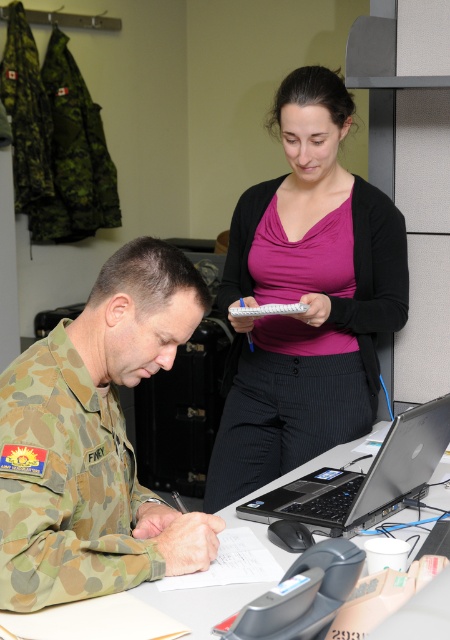
Between pink matte sweater at center and camouflage uniform at center, which one has less height?

With less height is camouflage uniform at center.

Is pink matte sweater at center in front of camouflage uniform at center?

That is False.

Identify the location of pink matte sweater at center. (306, 298).

Can you confirm if pink matte sweater at center is positioned above silver/black laptop at center?

Yes.

Where is `pink matte sweater at center`? This screenshot has width=450, height=640. pink matte sweater at center is located at coordinates (306, 298).

Between point (244, 253) and point (418, 477), which one is positioned behind?

The point (244, 253) is behind.

You are a GUI agent. You are given a task and a screenshot of the screen. Output one action in this format:
    pyautogui.click(x=<x>, y=<y>)
    Task: Click on the pink matte sweater at center
    This screenshot has width=450, height=640.
    Given the screenshot: What is the action you would take?
    pyautogui.click(x=306, y=298)

Is point (247, 454) positioned in front of point (208, 604)?

No, it is behind (208, 604).

Can you confirm if pink matte sweater at center is bigger than white paper at center?

Yes, pink matte sweater at center is bigger than white paper at center.

Is point (235, 259) positioned behind point (130, 632)?

Yes, it is behind point (130, 632).

The image size is (450, 640). What are the coordinates of `pink matte sweater at center` in the screenshot? It's located at (306, 298).